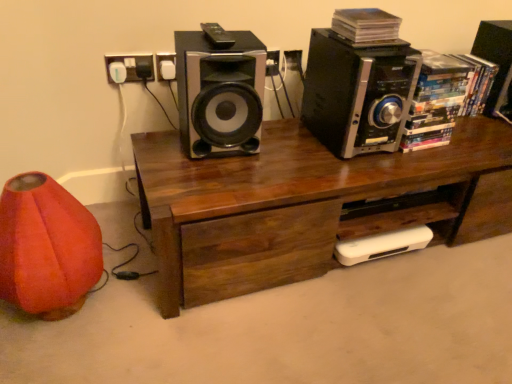
Where is `free space that is in between orange fabric bean bag chair at lower left and wooden desk at center`? The width and height of the screenshot is (512, 384). free space that is in between orange fabric bean bag chair at lower left and wooden desk at center is located at coordinates (155, 284).